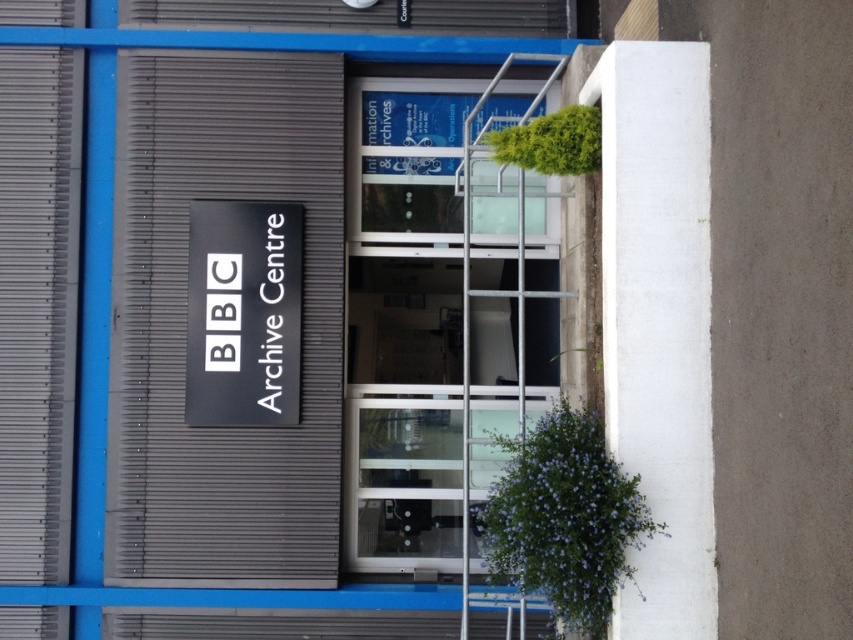
You are a delivery person with a package that requires a 1.5 meter clearance to pass through the entrance of the BBC Archive Centre. Can you fit through the space between the transparent glass door at center and the black matte sign at center?

The transparent glass door at center and the black matte sign at center are 1.71 meters apart, which is wider than the required 1.5 meter clearance. Therefore, the package can fit through the space between them.

In the scene shown: You are a visitor arriving at the BBC Archive Centre. You see the transparent glass door at center and the black matte sign at center. Which object is located higher up on the building facade?

The black matte sign at center is located higher up on the building facade because the transparent glass door at center is below it.